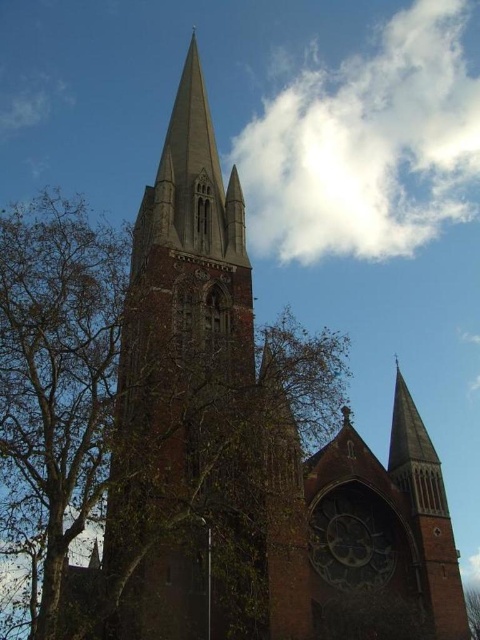
Question: Can you confirm if brown textured tree at left is positioned above white fluffy cloud at upper center?

Choices:
 (A) no
 (B) yes

Answer: (A)

Question: Which point is farther to the camera?

Choices:
 (A) brown textured tree at left
 (B) white fluffy cloud at upper center
 (C) dark brown wooden clock at center

Answer: (B)

Question: Estimate the real-world distances between objects in this image. Which object is closer to the brown textured tree at left?

Choices:
 (A) dark brown wooden clock at center
 (B) white fluffy cloud at upper center

Answer: (A)

Question: Is brown textured tree at left bigger than dark brown wooden clock at center?

Choices:
 (A) yes
 (B) no

Answer: (A)

Question: Which point is closer to the camera?

Choices:
 (A) brown textured tree at left
 (B) dark brown wooden clock at center
 (C) red brick church steeple at center
 (D) white fluffy cloud at upper center

Answer: (A)

Question: Is white fluffy cloud at upper center above dark brown wooden clock at center?

Choices:
 (A) yes
 (B) no

Answer: (A)